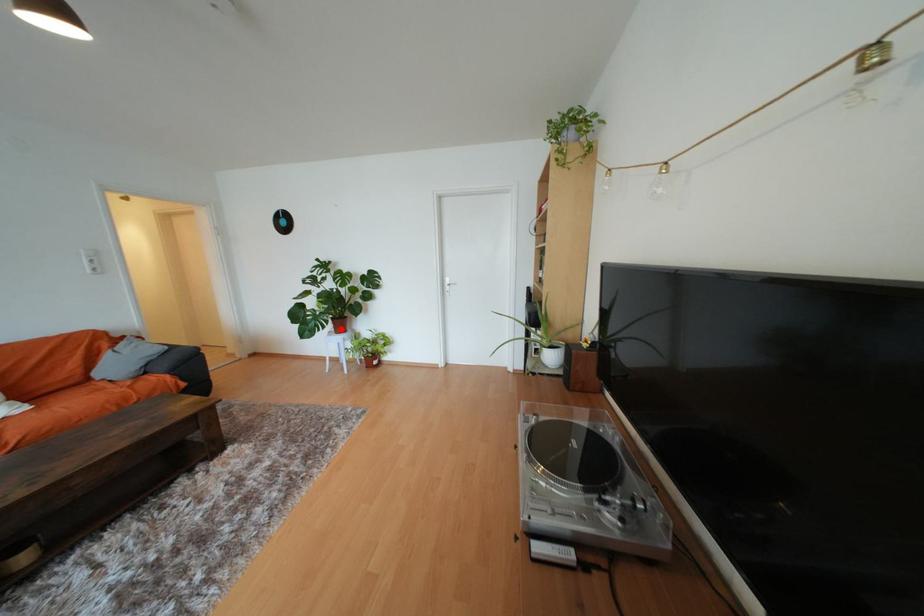
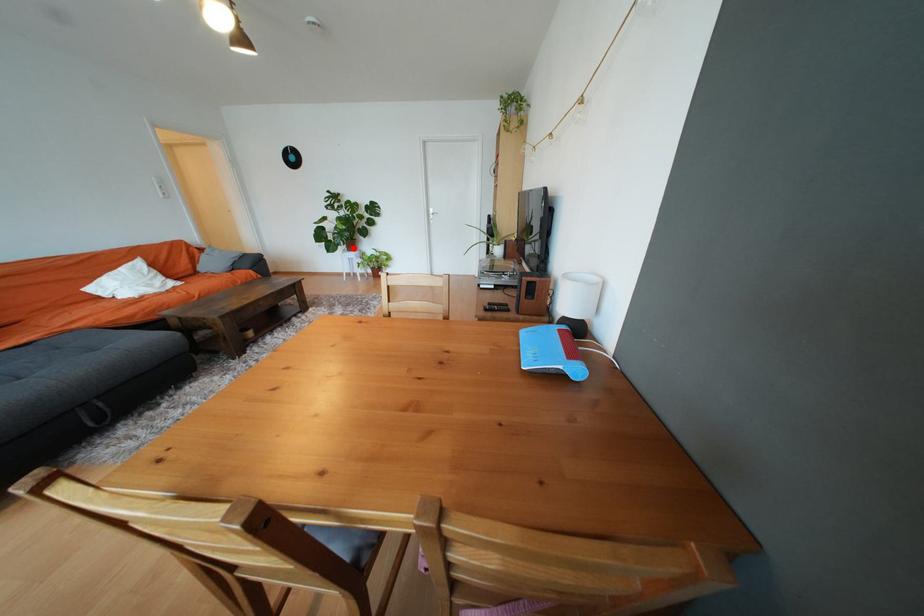
I am providing you with two images of the same scene from different viewpoints. A red point is marked on the first image and another point is marked on the second image. Are the points marked in image1 and image2 representing the same 3D position?

Yes